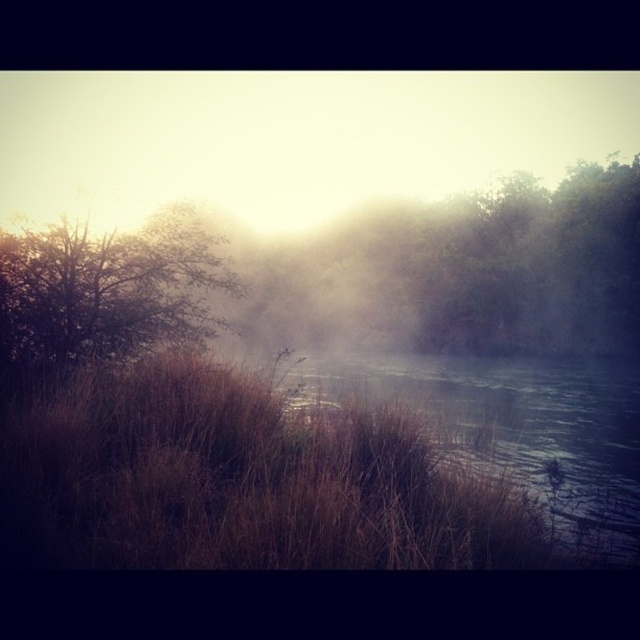
Question: Estimate the real-world distances between objects in this image. Which object is closer to the brown textured tree at left?

Choices:
 (A) brown grassy river at center
 (B) brown matte tree at center

Answer: (A)

Question: Which of the following is the farthest from the observer?

Choices:
 (A) (460, 380)
 (B) (209, 307)

Answer: (A)

Question: Can you confirm if brown matte tree at center is thinner than brown grassy river at center?

Choices:
 (A) no
 (B) yes

Answer: (A)

Question: Can you confirm if brown grassy river at center is positioned above brown textured tree at left?

Choices:
 (A) no
 (B) yes

Answer: (A)

Question: Is brown grassy river at center smaller than brown textured tree at left?

Choices:
 (A) no
 (B) yes

Answer: (A)

Question: Which point is closer to the camera taking this photo?

Choices:
 (A) (595, 547)
 (B) (80, 358)

Answer: (A)